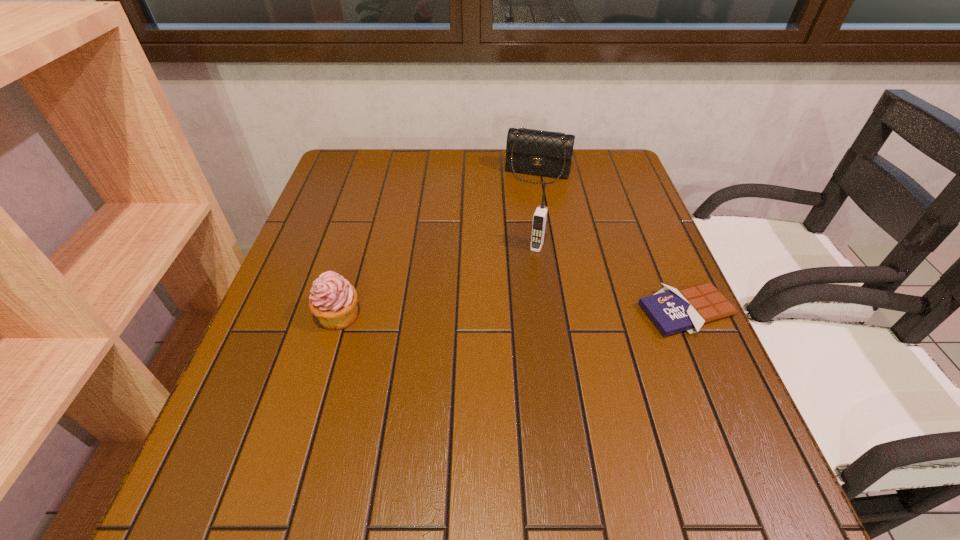
Find the location of `vacant space on the desktop that is between the leftmost object and the shortest object and is positioned on the front flap of the clutch bag`. vacant space on the desktop that is between the leftmost object and the shortest object and is positioned on the front flap of the clutch bag is located at coordinates (496, 314).

What are the coordinates of `free spot on the desktop that is between the leftmost object and the rightmost object and is positioned on the front-facing side of the second farthest object` in the screenshot? It's located at (511, 314).